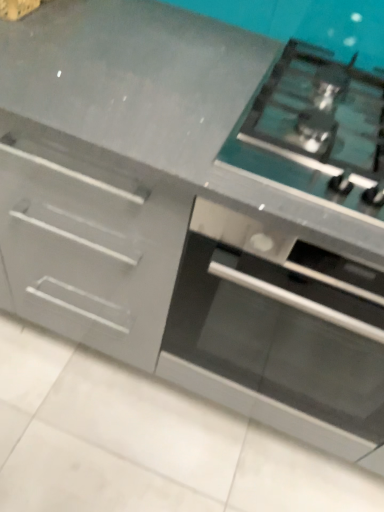
Question: Can you confirm if stainless steel oven at center is positioned to the right of satin silver gas stove at upper right?

Choices:
 (A) no
 (B) yes

Answer: (B)

Question: From a real-world perspective, does stainless steel oven at center stand above satin silver gas stove at upper right?

Choices:
 (A) no
 (B) yes

Answer: (A)

Question: Is stainless steel oven at center in contact with satin silver gas stove at upper right?

Choices:
 (A) yes
 (B) no

Answer: (B)

Question: From the image's perspective, is stainless steel oven at center on top of satin silver gas stove at upper right?

Choices:
 (A) yes
 (B) no

Answer: (B)

Question: From the image's perspective, does stainless steel oven at center appear lower than satin silver gas stove at upper right?

Choices:
 (A) no
 (B) yes

Answer: (B)

Question: Is stainless steel oven at center turned away from satin silver gas stove at upper right?

Choices:
 (A) yes
 (B) no

Answer: (B)

Question: From a real-world perspective, is satin silver gas stove at upper right located higher than stainless steel oven at center?

Choices:
 (A) yes
 (B) no

Answer: (A)

Question: Can you confirm if satin silver gas stove at upper right is positioned to the left of stainless steel oven at center?

Choices:
 (A) no
 (B) yes

Answer: (B)

Question: From the image's perspective, is satin silver gas stove at upper right on top of stainless steel oven at center?

Choices:
 (A) no
 (B) yes

Answer: (B)

Question: Considering the relative sizes of satin silver gas stove at upper right and stainless steel oven at center in the image provided, is satin silver gas stove at upper right shorter than stainless steel oven at center?

Choices:
 (A) yes
 (B) no

Answer: (A)

Question: Is satin silver gas stove at upper right not inside stainless steel oven at center?

Choices:
 (A) no
 (B) yes

Answer: (B)

Question: Is satin silver gas stove at upper right to the right of stainless steel oven at center from the viewer's perspective?

Choices:
 (A) no
 (B) yes

Answer: (A)

Question: Is satin silver gas stove at upper right inside or outside of stainless steel oven at center?

Choices:
 (A) inside
 (B) outside

Answer: (B)